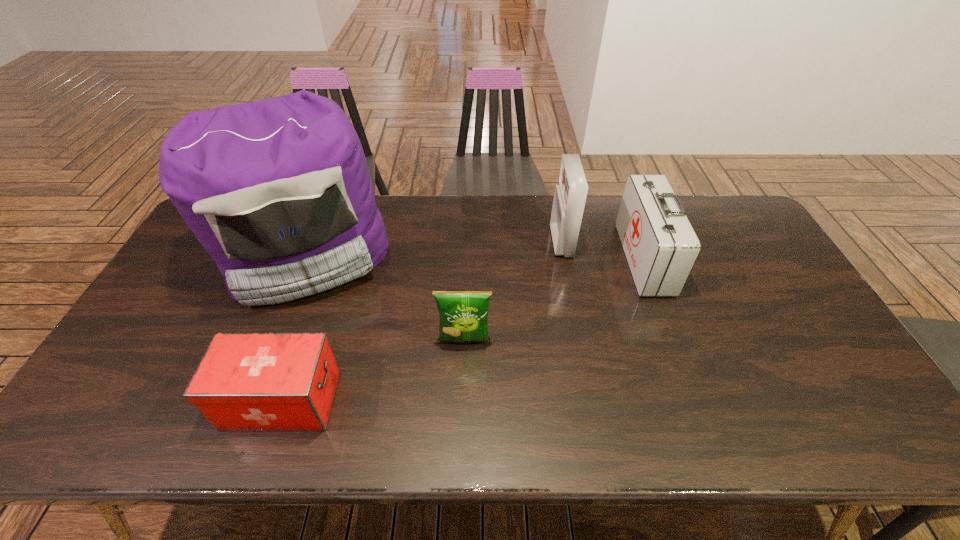
You are a GUI agent. You are given a task and a screenshot of the screen. Output one action in this format:
    pyautogui.click(x=<x>, y=<y>)
    Task: Click on the free spot between the tallest object and the third object from left to right
    The height and width of the screenshot is (540, 960).
    Given the screenshot: What is the action you would take?
    pyautogui.click(x=386, y=299)

Locate an element on the screen. This screenshot has width=960, height=540. vacant area that lies between the tallest object and the nearest object is located at coordinates (295, 328).

You are a GUI agent. You are given a task and a screenshot of the screen. Output one action in this format:
    pyautogui.click(x=<x>, y=<y>)
    Task: Click on the unoccupied area between the backpack and the shortest object
    Image resolution: width=960 pixels, height=540 pixels.
    Given the screenshot: What is the action you would take?
    pyautogui.click(x=295, y=328)

You are a GUI agent. You are given a task and a screenshot of the screen. Output one action in this format:
    pyautogui.click(x=<x>, y=<y>)
    Task: Click on the free space between the fourth farthest object and the second tallest first-aid kit
    The height and width of the screenshot is (540, 960).
    Given the screenshot: What is the action you would take?
    pyautogui.click(x=554, y=300)

Identify the location of free spot between the second tallest first-aid kit and the crisp (potato chip). (554, 300).

In order to click on blank region between the tallest first-aid kit and the fourth farthest object in this screenshot , I will do [x=513, y=291].

The width and height of the screenshot is (960, 540). I want to click on the third closest object relative to the second tallest first-aid kit, so click(278, 192).

Locate which object ranks fourth in proximity to the third object from left to right. Please provide its 2D coordinates. Your answer should be formatted as a tuple, i.e. [(x, y)], where the tuple contains the x and y coordinates of a point satisfying the conditions above.

[(661, 247)]

Point out which first-aid kit is positioned as the nearest to the second first-aid kit from right to left. Please provide its 2D coordinates. Your answer should be formatted as a tuple, i.e. [(x, y)], where the tuple contains the x and y coordinates of a point satisfying the conditions above.

[(661, 247)]

Locate which first-aid kit is the closest to the tallest object. Please provide its 2D coordinates. Your answer should be formatted as a tuple, i.e. [(x, y)], where the tuple contains the x and y coordinates of a point satisfying the conditions above.

[(246, 381)]